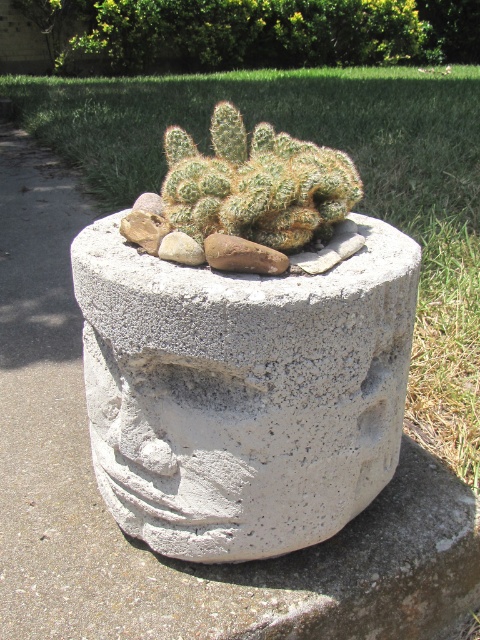
Question: Can you confirm if white concrete planter at center is positioned to the right of green spiky cactus at center?

Choices:
 (A) yes
 (B) no

Answer: (A)

Question: Can you confirm if white concrete planter at center is positioned to the right of green spiky cactus at center?

Choices:
 (A) yes
 (B) no

Answer: (A)

Question: Does white concrete planter at center have a greater width compared to green spiky cactus at center?

Choices:
 (A) no
 (B) yes

Answer: (A)

Question: Which of the following is the closest to the observer?

Choices:
 (A) (412, 378)
 (B) (343, 346)

Answer: (B)